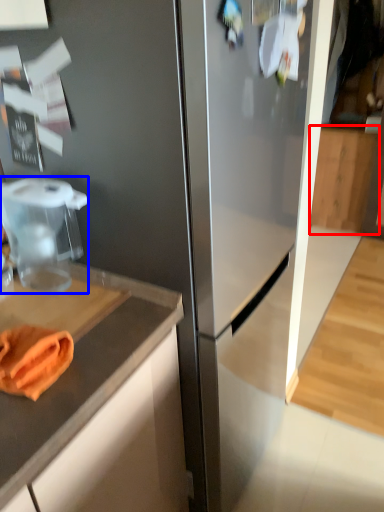
Question: Which object is further to the camera taking this photo, cabinetry (highlighted by a red box) or food processor (highlighted by a blue box)?

Choices:
 (A) cabinetry
 (B) food processor

Answer: (A)